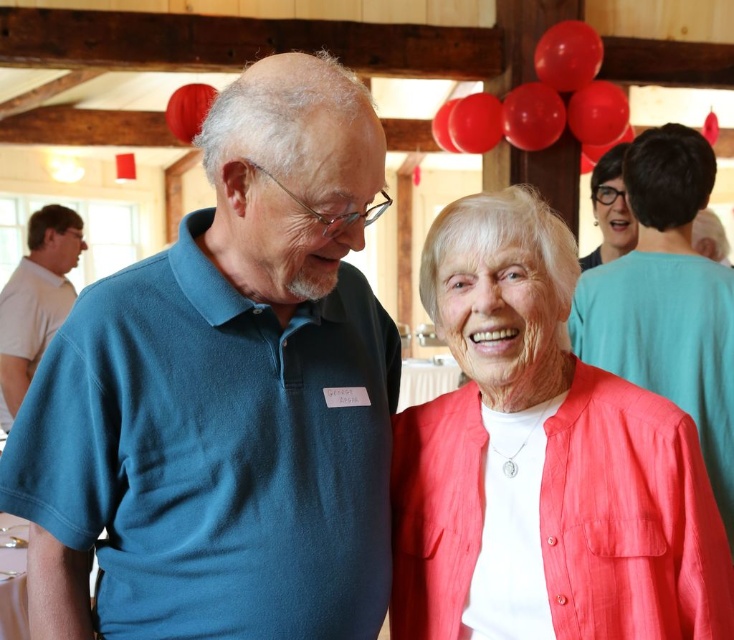
Does blue cotton polo shirt at left have a lesser width compared to white cotton shirt at left?

No.

I want to click on blue cotton polo shirt at left, so click(225, 396).

Where is `blue cotton polo shirt at left`? blue cotton polo shirt at left is located at coordinates (225, 396).

Between blue cotton polo shirt at left and matte black glasses at upper right, which one is positioned lower?

blue cotton polo shirt at left is below.

Does blue cotton polo shirt at left have a greater height compared to matte black glasses at upper right?

Yes.

Measure the distance between point (261, 144) and camera.

The distance of point (261, 144) from camera is 3.79 feet.

Where is `blue cotton polo shirt at left`? Image resolution: width=734 pixels, height=640 pixels. blue cotton polo shirt at left is located at coordinates (225, 396).

Between white cotton shirt at left and matte black glasses at upper right, which one is positioned higher?

matte black glasses at upper right is higher up.

Which is below, white cotton shirt at left or matte black glasses at upper right?

Positioned lower is white cotton shirt at left.

The height and width of the screenshot is (640, 734). What do you see at coordinates (34, 300) in the screenshot?
I see `white cotton shirt at left` at bounding box center [34, 300].

The height and width of the screenshot is (640, 734). Identify the location of white cotton shirt at left. (34, 300).